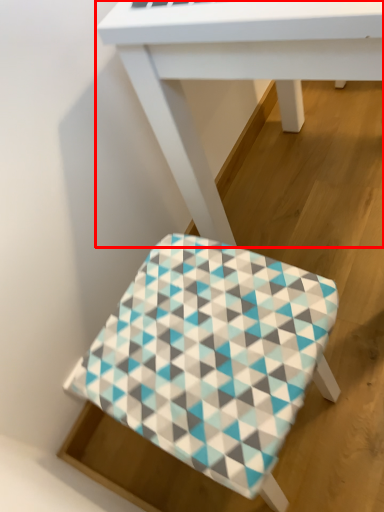
Question: From the image's perspective, where is table (annotated by the red box) located in relation to stool in the image?

Choices:
 (A) above
 (B) below

Answer: (A)